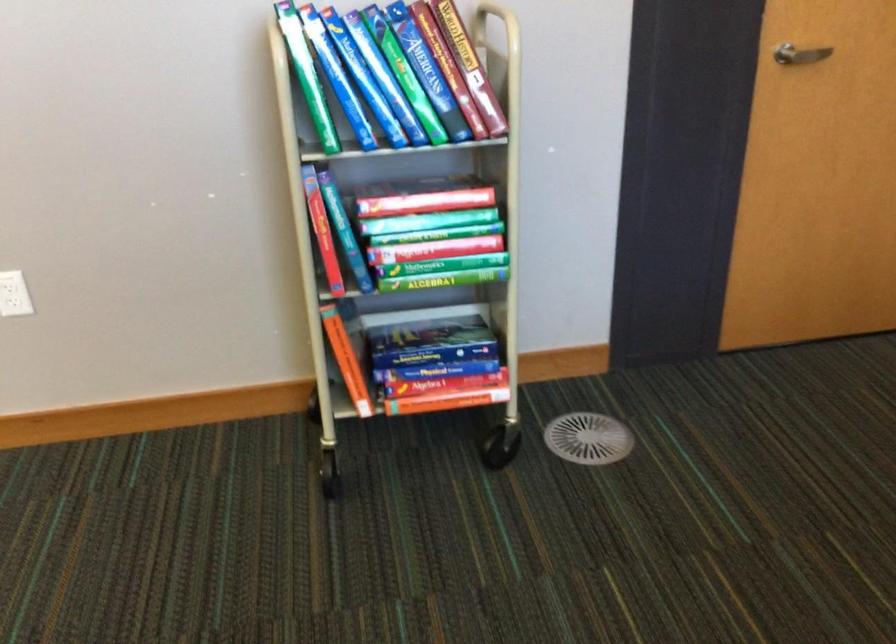
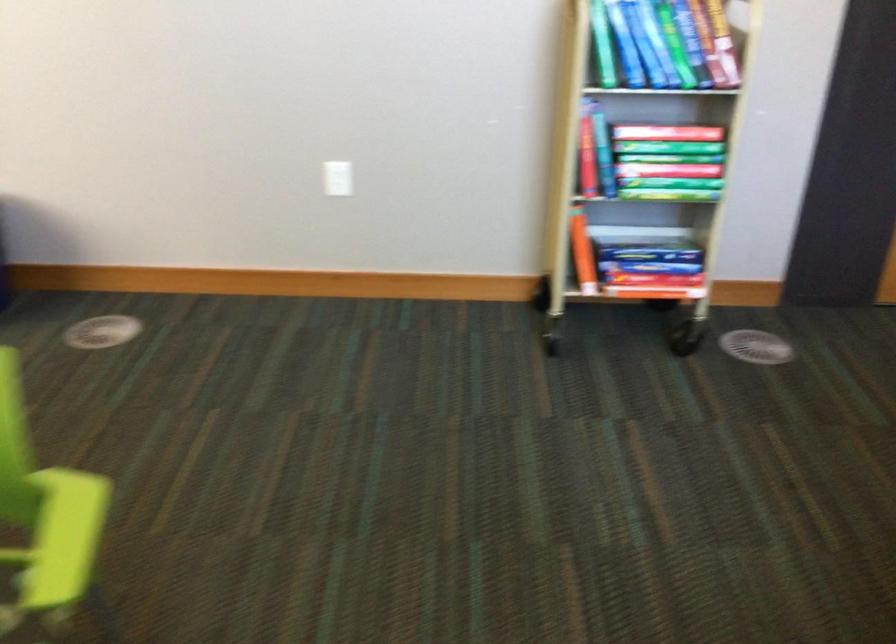
Question: Based on the continuous images, in which direction is the camera rotating? Reply with the corresponding letter.

Choices:
 (A) Left
 (B) Right
 (C) Up
 (D) Down

Answer: (A)